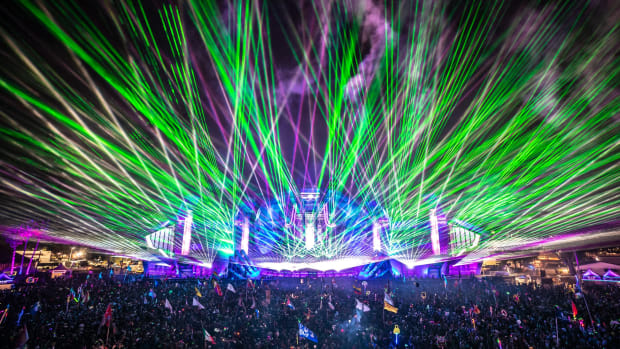
What are the coordinates of `visual displays` in the screenshot? It's located at (383, 269), (237, 268).